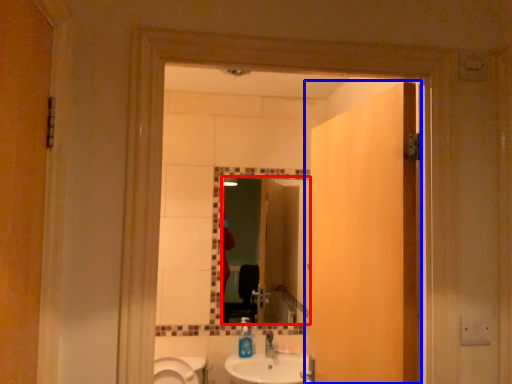
Question: Among these objects, which one is nearest to the camera, mirror (highlighted by a red box) or door (highlighted by a blue box)?

Choices:
 (A) mirror
 (B) door

Answer: (B)